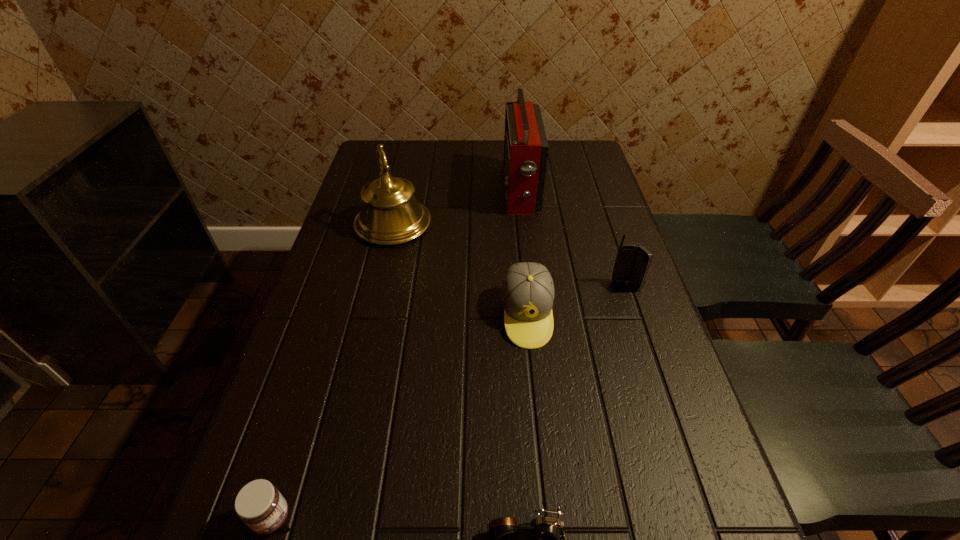
You are a GUI agent. You are given a task and a screenshot of the screen. Output one action in this format:
    pyautogui.click(x=<x>, y=<y>)
    Task: Click on the free spot that satisfies the following two spatial constraints: 1. on the front-facing side of the radio receiver; 2. on the front label of the jam
    
    Given the screenshot: What is the action you would take?
    pyautogui.click(x=558, y=518)